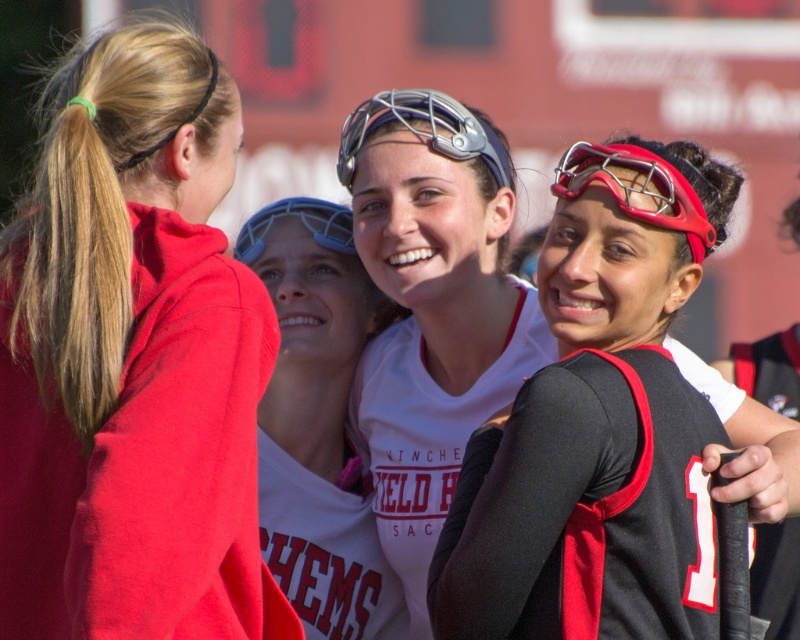
Question: Considering the relative positions of white matte jersey at center and matte blue plastic goggles at center in the image provided, where is white matte jersey at center located with respect to matte blue plastic goggles at center?

Choices:
 (A) above
 (B) below

Answer: (B)

Question: Where is matte red hoodie at left located in relation to red matte metal goggles at upper right in the image?

Choices:
 (A) below
 (B) above

Answer: (B)

Question: Which of the following is the closest to the observer?

Choices:
 (A) (220, 81)
 (B) (238, 250)
 (C) (574, 152)
 (D) (377, 570)

Answer: (C)

Question: Which point is farther to the camera?

Choices:
 (A) (374, 609)
 (B) (440, 115)

Answer: (A)

Question: From the image, what is the correct spatial relationship of red matte metal goggles at upper right in relation to metallic silver goggles at center?

Choices:
 (A) below
 (B) above

Answer: (A)

Question: Based on their relative distances, which object is farther from the matte white jersey at center?

Choices:
 (A) matte blue plastic goggles at center
 (B) red matte metal goggles at upper right

Answer: (A)